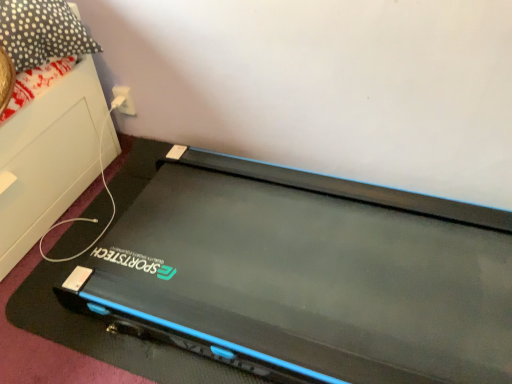
Identify the location of black matte treadmill at center. (313, 273).

Find the location of a particular element. white plastic at upper center is located at coordinates (124, 100).

Does polka dot fabric pillow at upper left have a greater height compared to black matte treadmill at center?

No, polka dot fabric pillow at upper left is not taller than black matte treadmill at center.

Considering the points (16, 37) and (258, 168), which point is in front, point (16, 37) or point (258, 168)?

The point (16, 37) is in front.

Looking at this image, is polka dot fabric pillow at upper left placed right next to black matte treadmill at center?

There is a gap between polka dot fabric pillow at upper left and black matte treadmill at center.

Does white plastic at upper center have a larger size compared to polka dot fabric pillow at upper left?

Actually, white plastic at upper center might be smaller than polka dot fabric pillow at upper left.

Which is correct: white plastic at upper center is inside polka dot fabric pillow at upper left, or outside of it?

white plastic at upper center is located beyond the bounds of polka dot fabric pillow at upper left.

From a real-world perspective, is white plastic at upper center above or below polka dot fabric pillow at upper left?

white plastic at upper center is below polka dot fabric pillow at upper left.

Is point (129, 104) closer or farther from the camera than point (26, 43)?

Point (129, 104) appears to be farther away from the viewer than point (26, 43).

Is black matte treadmill at center in contact with white plastic at upper center?

black matte treadmill at center and white plastic at upper center are not in contact.

Could you tell me if black matte treadmill at center is facing white plastic at upper center?

No, black matte treadmill at center is not aimed at white plastic at upper center.

Which object is further away from the camera taking this photo, black matte treadmill at center or white plastic at upper center?

white plastic at upper center.

Considering the positions of points (307, 375) and (121, 90), is point (307, 375) farther from camera compared to point (121, 90)?

No.

Considering the relative positions of white plastic at upper center and black matte treadmill at center in the image provided, is white plastic at upper center in front of black matte treadmill at center?

No, white plastic at upper center is further to the viewer.

Is white plastic at upper center looking in the opposite direction of black matte treadmill at center?

No, white plastic at upper center is not facing away from black matte treadmill at center.

Is white plastic at upper center inside or outside of black matte treadmill at center?

The correct answer is: outside.

Is black matte treadmill at center taller or shorter than polka dot fabric pillow at upper left?

Clearly, black matte treadmill at center is taller compared to polka dot fabric pillow at upper left.

Is black matte treadmill at center wider or thinner than polka dot fabric pillow at upper left?

Considering their sizes, black matte treadmill at center looks broader than polka dot fabric pillow at upper left.

From a real-world perspective, is black matte treadmill at center beneath polka dot fabric pillow at upper left?

Correct, in the physical world, black matte treadmill at center is lower than polka dot fabric pillow at upper left.

Locate an element on the screen. This screenshot has height=384, width=512. computer in front of the polka dot fabric pillow at upper left is located at coordinates (313, 273).

Does polka dot fabric pillow at upper left turn towards white plastic at upper center?

No, polka dot fabric pillow at upper left does not turn towards white plastic at upper center.

Considering the positions of objects polka dot fabric pillow at upper left and white plastic at upper center in the image provided, who is behind, polka dot fabric pillow at upper left or white plastic at upper center?

Positioned behind is white plastic at upper center.

Which is nearer, [47,27] or [113,94]?

Clearly, point [47,27] is closer to the camera than point [113,94].

What's the angular difference between polka dot fabric pillow at upper left and white plastic at upper center's facing directions?

They differ by 2.92 degrees in their facing directions.

Image resolution: width=512 pixels, height=384 pixels. What are the coordinates of `computer in front of the polka dot fabric pillow at upper left` in the screenshot? It's located at (313, 273).

At what (x,y) coordinates should I click in order to perform the action: click on electric outlet behind the polka dot fabric pillow at upper left. Please return your answer as a coordinate pair (x, y). Image resolution: width=512 pixels, height=384 pixels. Looking at the image, I should click on (124, 100).

Considering their positions, is white plastic at upper center positioned closer to black matte treadmill at center than polka dot fabric pillow at upper left?

polka dot fabric pillow at upper left.

Which object lies nearer to the anchor point black matte treadmill at center, polka dot fabric pillow at upper left or white plastic at upper center?

The object closer to black matte treadmill at center is polka dot fabric pillow at upper left.

Estimate the real-world distances between objects in this image. Which object is closer to polka dot fabric pillow at upper left, black matte treadmill at center or white plastic at upper center?

Among the two, white plastic at upper center is located nearer to polka dot fabric pillow at upper left.

Based on their spatial positions, is white plastic at upper center or black matte treadmill at center further from polka dot fabric pillow at upper left?

black matte treadmill at center lies further to polka dot fabric pillow at upper left than the other object.

Based on their spatial positions, is black matte treadmill at center or polka dot fabric pillow at upper left closer to white plastic at upper center?

The object closer to white plastic at upper center is polka dot fabric pillow at upper left.

Based on their spatial positions, is polka dot fabric pillow at upper left or black matte treadmill at center further from white plastic at upper center?

black matte treadmill at center is positioned further to the anchor white plastic at upper center.

Identify the location of pillow between black matte treadmill at center and white plastic at upper center in the front-back direction. (41, 32).